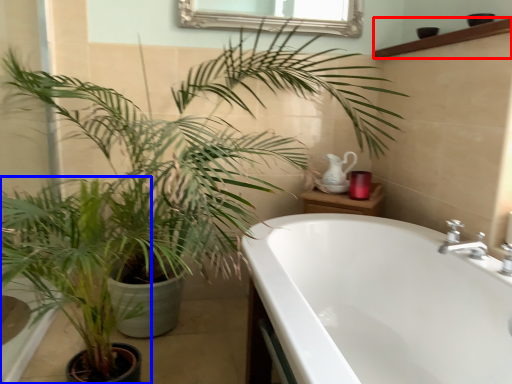
Question: Which of the following is the farthest to the observer, balustrade (highlighted by a red box) or houseplant (highlighted by a blue box)?

Choices:
 (A) balustrade
 (B) houseplant

Answer: (A)